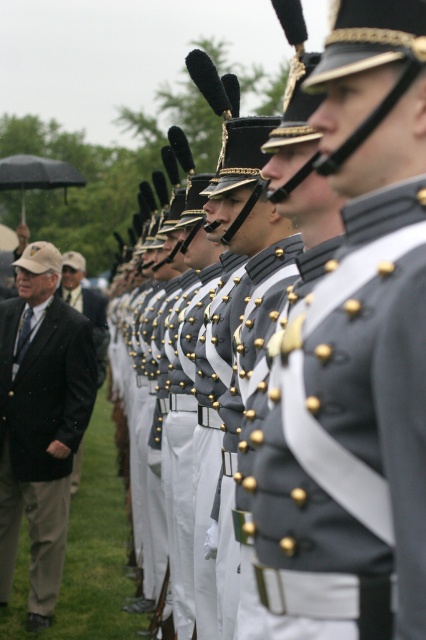
Is gray matte uniform at center shorter than black wool jacket at left?

Indeed, gray matte uniform at center has a lesser height compared to black wool jacket at left.

What do you see at coordinates (350, 436) in the screenshot? I see `gray matte uniform at center` at bounding box center [350, 436].

Is point (354, 232) positioned behind point (94, 330)?

No.

Locate an element on the screen. This screenshot has height=640, width=426. gray matte uniform at center is located at coordinates (350, 436).

Can you confirm if black wool suit at left is positioned to the left of black wool jacket at left?

In fact, black wool suit at left is to the right of black wool jacket at left.

Does black wool suit at left come behind black wool jacket at left?

That is False.

Who is more forward, [71,308] or [75,253]?

Point [71,308] is more forward.

This screenshot has width=426, height=640. I want to click on black wool suit at left, so click(40, 440).

Which of these two, black wool jacket at left or black matte umbrella at left, stands taller?

With more height is black wool jacket at left.

Between point (75, 257) and point (37, 180), which one is positioned behind?

Positioned behind is point (75, 257).

Between point (104, 376) and point (6, 161), which one is positioned behind?

The point (6, 161) is behind.

Where is `black wool jacket at left`? Image resolution: width=426 pixels, height=640 pixels. black wool jacket at left is located at coordinates (85, 305).